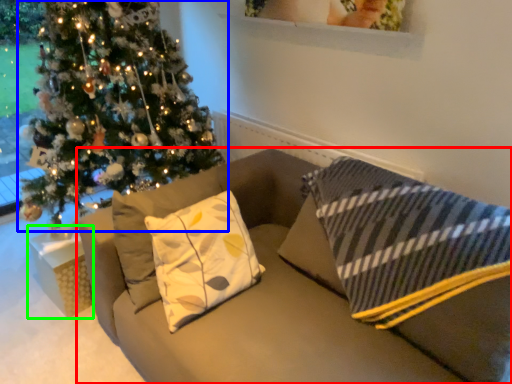
Question: Based on their relative distances, which object is nearer to studio couch (highlighted by a red box)? Choose from christmas tree (highlighted by a blue box) and furniture (highlighted by a green box).

Choices:
 (A) christmas tree
 (B) furniture

Answer: (B)